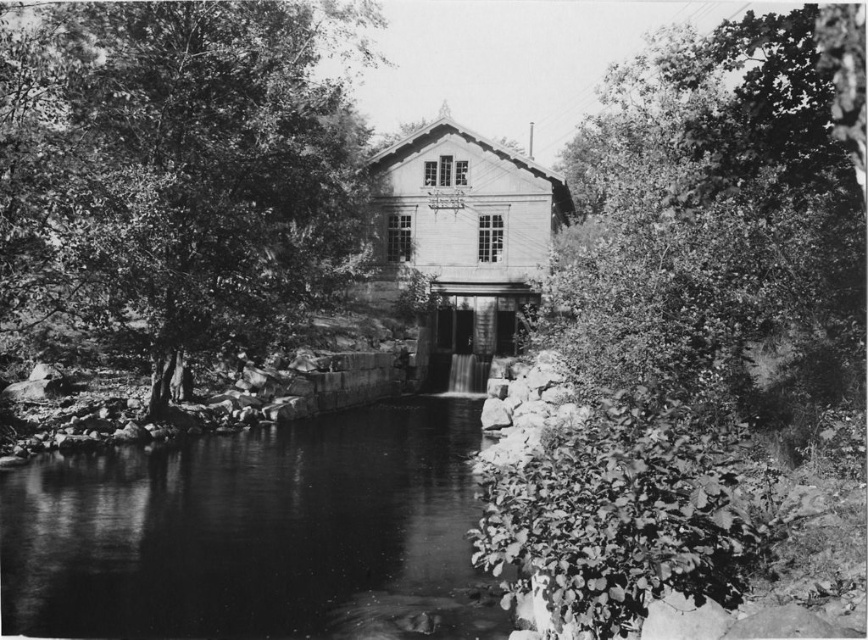
Question: Which of the following is the farthest from the observer?

Choices:
 (A) thick green foliage at right
 (B) smooth bark tree at center

Answer: (B)

Question: In this image, where is smooth bark tree at center located relative to thick green foliage at right?

Choices:
 (A) right
 (B) left

Answer: (B)

Question: Which is farther from the smooth bark tree at center?

Choices:
 (A) thick green foliage at right
 (B) smooth stone river at center

Answer: (A)

Question: In this image, where is smooth bark tree at center located relative to smooth stone river at center?

Choices:
 (A) right
 (B) left

Answer: (B)

Question: Which point appears closest to the camera in this image?

Choices:
 (A) (648, 221)
 (B) (150, 566)
 (C) (7, 88)

Answer: (B)

Question: Does smooth bark tree at center have a greater width compared to smooth stone river at center?

Choices:
 (A) no
 (B) yes

Answer: (A)